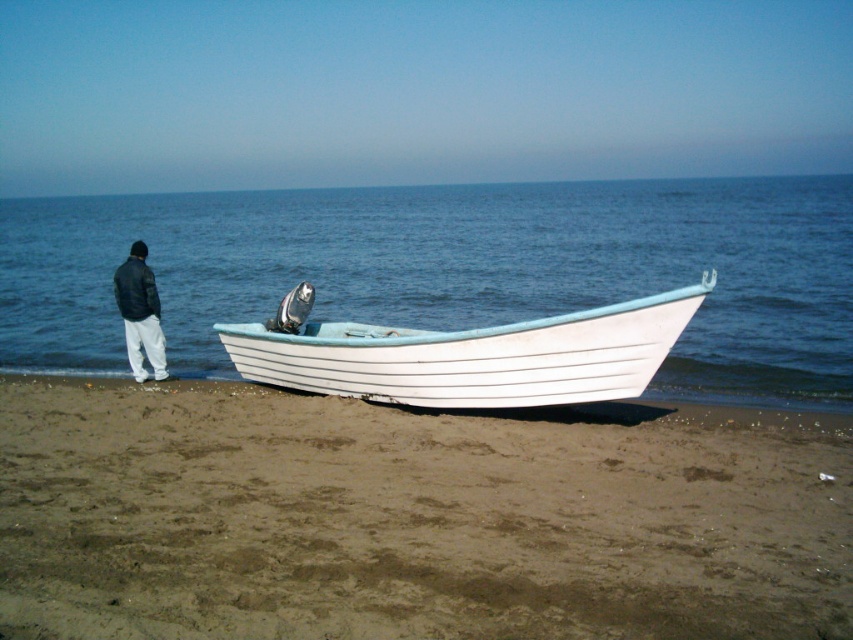
Question: Which object appears farthest from the camera in this image?

Choices:
 (A) black leather jacket at left
 (B) brown sandy beach at lower center

Answer: (A)

Question: Is white wood boat at center to the right of black leather jacket at left from the viewer's perspective?

Choices:
 (A) yes
 (B) no

Answer: (A)

Question: Can you confirm if brown sandy beach at lower center is smaller than blue water at boat right?

Choices:
 (A) yes
 (B) no

Answer: (A)

Question: Among these objects, which one is farthest from the camera?

Choices:
 (A) blue water at boat right
 (B) brown sandy beach at lower center
 (C) white wood boat at center

Answer: (C)

Question: In this image, where is brown sandy beach at lower center located relative to white wood boat at center?

Choices:
 (A) below
 (B) above

Answer: (A)

Question: Which point is closer to the camera taking this photo?

Choices:
 (A) (799, 241)
 (B) (634, 388)
 (C) (494, 468)

Answer: (C)